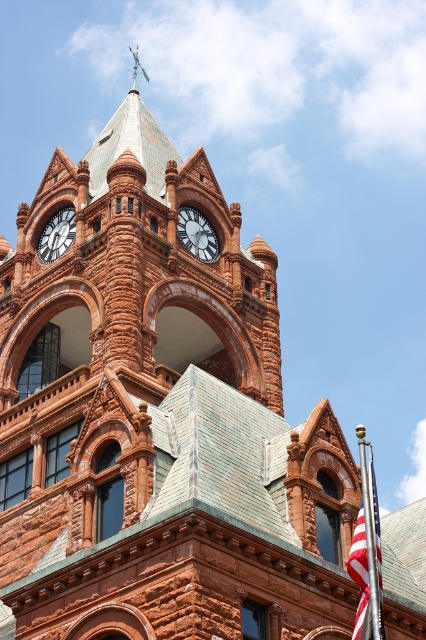
You are a photographer standing in front of the historic building. You want to capture a photo that includes both the american flag at lower right and the matte black clock at center. Which object should you position lower in your camera frame?

The american flag at lower right should be positioned lower in your camera frame because it is located below the matte black clock at center.

You are a photographer standing in front of the historic building. You want to take a photo of the matte black clock at center without the american flag at lower right appearing in the shot. Is this possible given their positions?

The american flag at lower right is in front of the matte black clock at center, so it will block the view of the clock. Therefore, it is not possible to take a photo of the matte black clock at center without the american flag at lower right appearing in the shot.

You are an architect planning to install a new decorative light between the matte black clock at center and the matte brown clock at upper left. The light requires a minimum of 5 meters of space between the two clocks to be safely installed. Based on the scene description, can the light be installed?

The distance between the matte black clock at center and the matte brown clock at upper left is 5.79 meters, which exceeds the required 5 meters. Therefore, the decorative light can be safely installed between them.